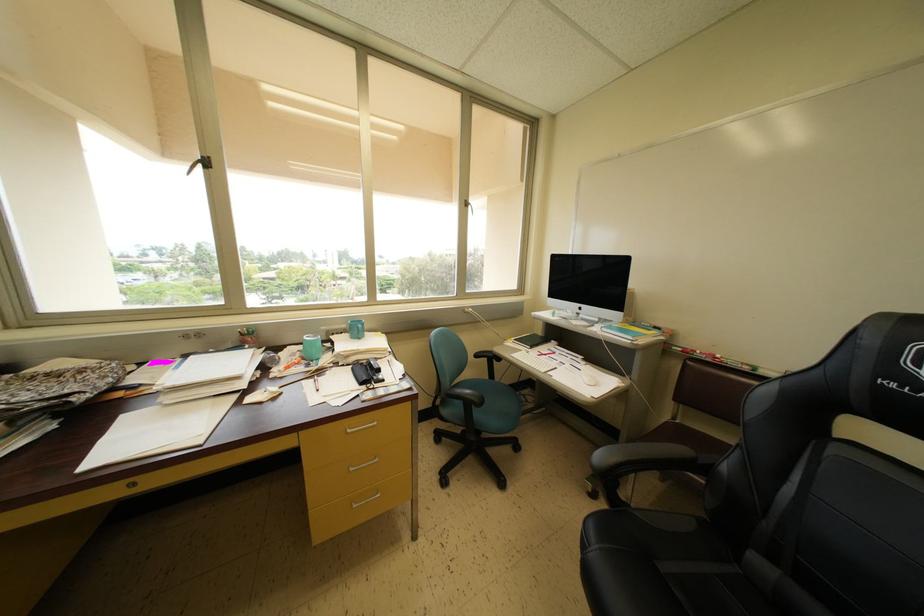
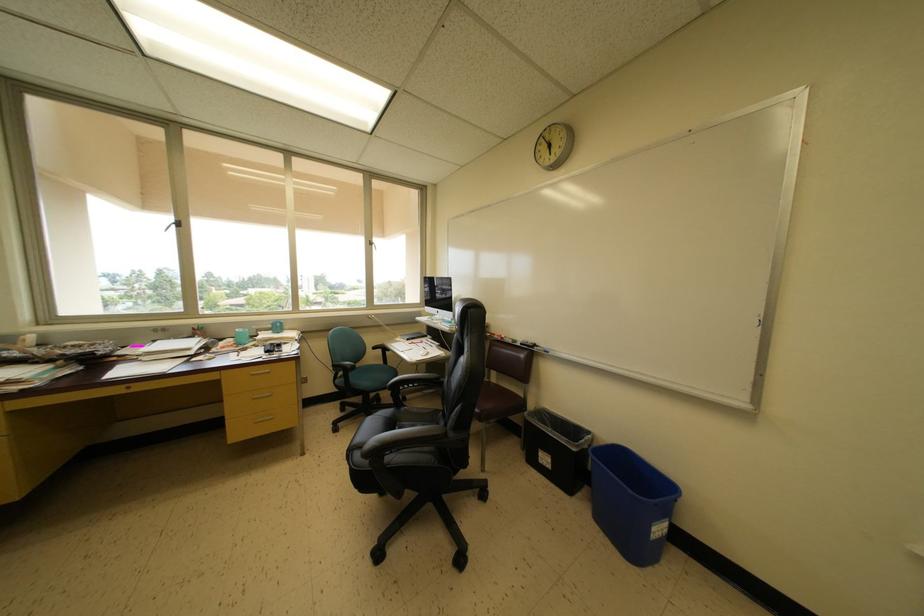
Locate, in the second image, the point that corresponds to [207,161] in the first image.

(179, 225)